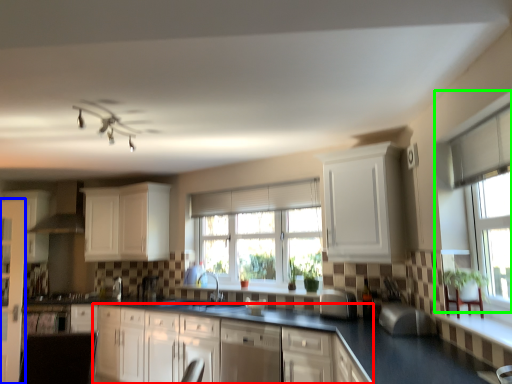
Question: Estimate the real-world distances between objects in this image. Which object is closer to cabinetry (highlighted by a red box), screen door (highlighted by a blue box) or window (highlighted by a green box)?

Choices:
 (A) screen door
 (B) window

Answer: (A)